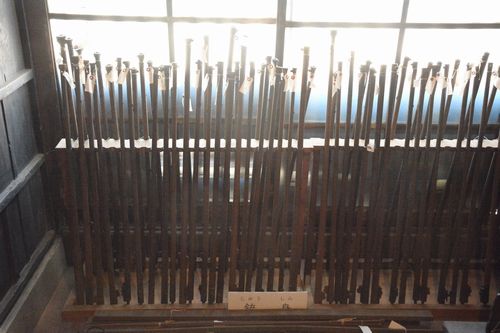
This screenshot has height=333, width=500. What are the coordinates of `floor` in the screenshot? It's located at (58, 319).